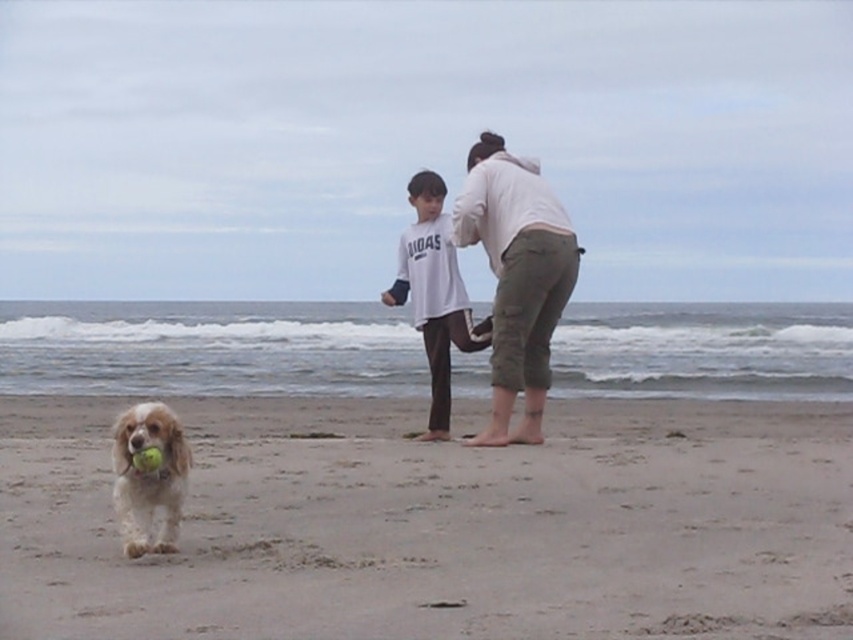
How distant is white cotton hoodie at center from white cotton shirt at center?

white cotton hoodie at center and white cotton shirt at center are 1.59 meters apart.

Which is more to the left, white cotton hoodie at center or white cotton shirt at center?

white cotton shirt at center is more to the left.

Who is more forward, (515,228) or (465,323)?

Point (515,228) is in front.

Find the location of a particular element. white cotton hoodie at center is located at coordinates pyautogui.click(x=515, y=276).

Does white cotton hoodie at center appear under golden fur dog at lower left?

No.

Consider the image. Between white cotton hoodie at center and golden fur dog at lower left, which one has more height?

Standing taller between the two is golden fur dog at lower left.

Is point (553, 227) closer to camera compared to point (170, 432)?

No, (553, 227) is further to viewer.

Find the location of `white cotton hoodie at center`. white cotton hoodie at center is located at coordinates (515, 276).

Can you confirm if smooth beige sand at center is thinner than white cotton hoodie at center?

No.

Who is taller, smooth beige sand at center or white cotton hoodie at center?

smooth beige sand at center is taller.

Locate an element on the screen. The image size is (853, 640). smooth beige sand at center is located at coordinates (438, 524).